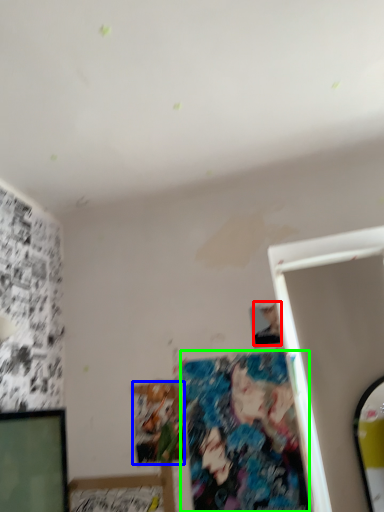
Question: Which object is positioned closest to person (highlighted by a red box)? Select from art (highlighted by a blue box) and art (highlighted by a green box).

Choices:
 (A) art
 (B) art

Answer: (B)